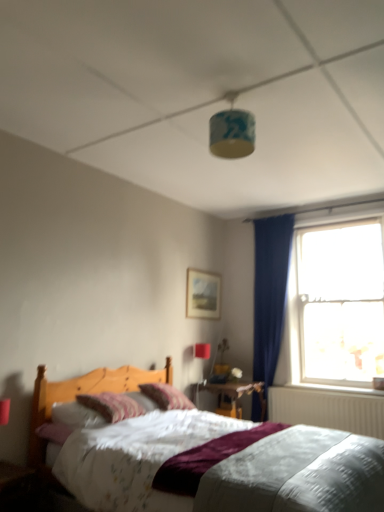
Question: Considering the relative sizes of white glossy window sill at lower right and transparent glass window at right in the image provided, is white glossy window sill at lower right thinner than transparent glass window at right?

Choices:
 (A) yes
 (B) no

Answer: (A)

Question: Can you see white glossy window sill at lower right touching transparent glass window at right?

Choices:
 (A) yes
 (B) no

Answer: (B)

Question: Is white glossy window sill at lower right behind transparent glass window at right?

Choices:
 (A) no
 (B) yes

Answer: (B)

Question: Is white glossy window sill at lower right aimed at transparent glass window at right?

Choices:
 (A) no
 (B) yes

Answer: (B)

Question: Is white glossy window sill at lower right positioned beyond the bounds of transparent glass window at right?

Choices:
 (A) yes
 (B) no

Answer: (B)

Question: Considering the positions of wooden nightstand at center and white glossy window sill at lower right in the image, is wooden nightstand at center bigger or smaller than white glossy window sill at lower right?

Choices:
 (A) small
 (B) big

Answer: (B)

Question: From their relative heights in the image, would you say wooden nightstand at center is taller or shorter than white glossy window sill at lower right?

Choices:
 (A) tall
 (B) short

Answer: (A)

Question: Visually, is wooden nightstand at center positioned to the left or to the right of white glossy window sill at lower right?

Choices:
 (A) left
 (B) right

Answer: (A)

Question: Is wooden nightstand at center wider or thinner than white glossy window sill at lower right?

Choices:
 (A) thin
 (B) wide

Answer: (B)

Question: Is blue fabric lampshade at upper center, the second light fixture when ordered from back to front, taller or shorter than wooden nightstand at center?

Choices:
 (A) short
 (B) tall

Answer: (A)

Question: Based on their sizes in the image, would you say blue fabric lampshade at upper center, the second light fixture when ordered from back to front, is bigger or smaller than wooden nightstand at center?

Choices:
 (A) small
 (B) big

Answer: (A)

Question: Which is correct: blue fabric lampshade at upper center, arranged as the first light fixture when viewed from the front, is inside wooden nightstand at center, or outside of it?

Choices:
 (A) outside
 (B) inside

Answer: (A)

Question: Would you say blue fabric lampshade at upper center, arranged as the first light fixture when viewed from the front, is to the left or to the right of wooden nightstand at center in the picture?

Choices:
 (A) left
 (B) right

Answer: (A)

Question: Considering the relative positions of wooden nightstand at center and transparent glass window at right in the image provided, is wooden nightstand at center to the left or to the right of transparent glass window at right?

Choices:
 (A) right
 (B) left

Answer: (B)

Question: From a real-world perspective, is wooden nightstand at center physically located above or below transparent glass window at right?

Choices:
 (A) below
 (B) above

Answer: (A)